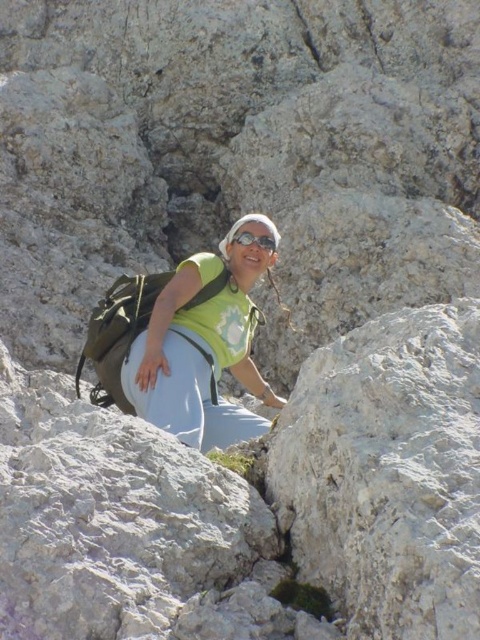
Question: Can you confirm if green matte shirt at center is positioned to the right of transparent plastic goggles at center?

Choices:
 (A) no
 (B) yes

Answer: (A)

Question: In this image, where is green matte shirt at center located relative to transparent plastic goggles at center?

Choices:
 (A) right
 (B) left

Answer: (B)

Question: Which point appears farthest from the camera in this image?

Choices:
 (A) (248, 241)
 (B) (158, 356)

Answer: (A)

Question: Is green matte shirt at center further to the viewer compared to transparent plastic goggles at center?

Choices:
 (A) no
 (B) yes

Answer: (A)